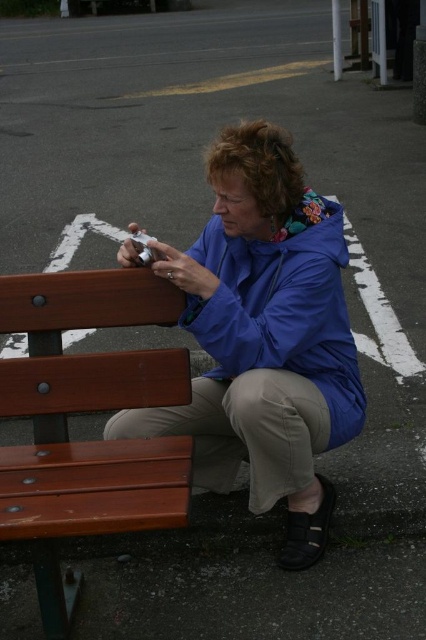
Question: Is blue fabric jacket at center to the left of blue matte jacket at center from the viewer's perspective?

Choices:
 (A) no
 (B) yes

Answer: (B)

Question: Is wooden bench at lower left positioned in front of blue matte jacket at center?

Choices:
 (A) yes
 (B) no

Answer: (A)

Question: Which object appears farthest from the camera in this image?

Choices:
 (A) wooden bench at lower left
 (B) blue matte jacket at center
 (C) blue fabric jacket at center

Answer: (B)

Question: Estimate the real-world distances between objects in this image. Which object is closer to the blue matte jacket at center?

Choices:
 (A) blue fabric jacket at center
 (B) wooden bench at lower left

Answer: (A)

Question: Does blue fabric jacket at center have a greater width compared to wooden bench at lower left?

Choices:
 (A) no
 (B) yes

Answer: (B)

Question: Which of these objects is positioned farthest from the blue matte jacket at center?

Choices:
 (A) blue fabric jacket at center
 (B) wooden bench at lower left

Answer: (B)